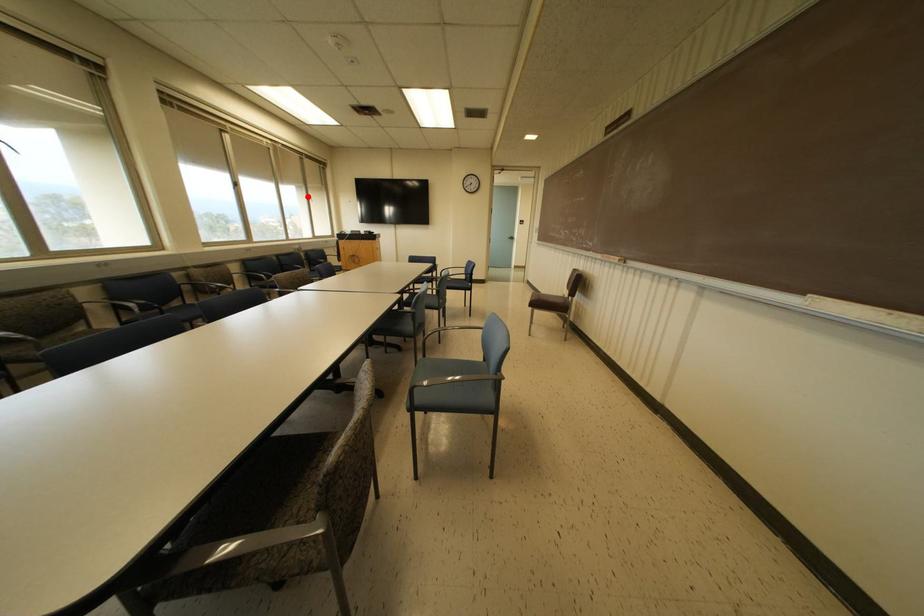
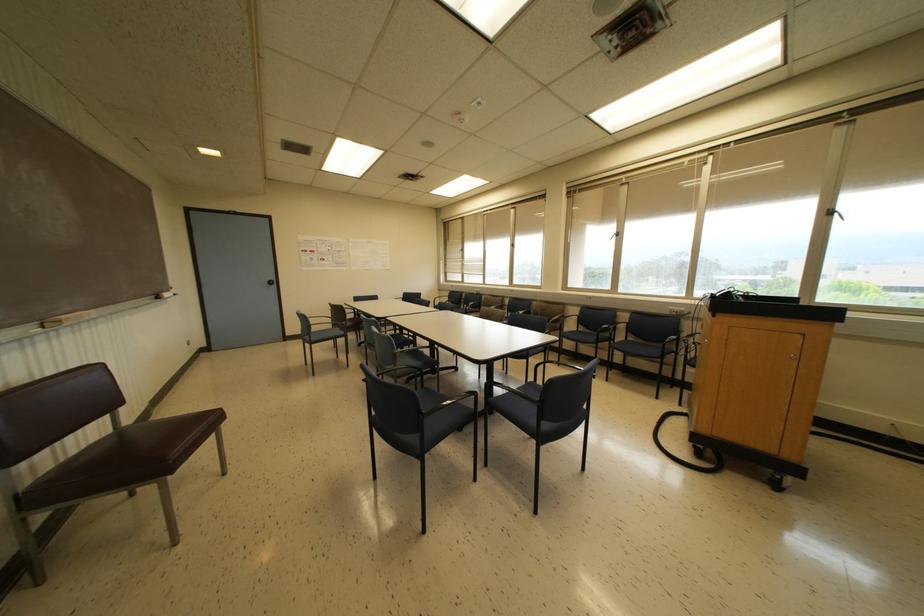
Question: I am providing you with two images of the same scene from different viewpoints. A red point is shown in image1. For the corresponding object point in image2, is it positioned nearer or farther from the camera?

Choices:
 (A) Nearer
 (B) Farther

Answer: (B)